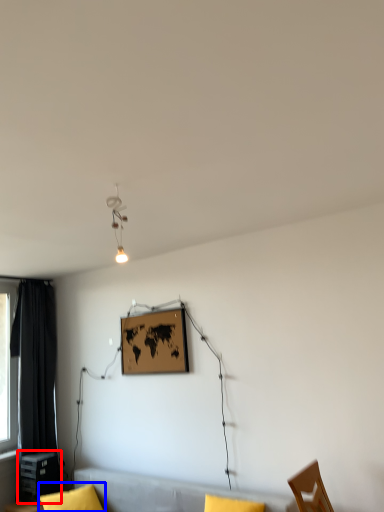
Question: Which point is closer to the camera, table (highlighted by a red box) or pillow (highlighted by a blue box)?

Choices:
 (A) table
 (B) pillow

Answer: (B)